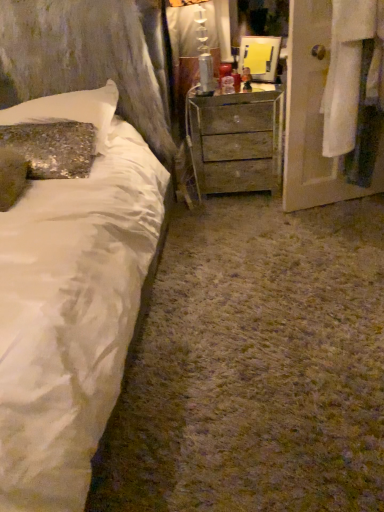
Find the location of `vacant region below wooden chest of drawers at center (from a real-world perspective)`. vacant region below wooden chest of drawers at center (from a real-world perspective) is located at coordinates (237, 195).